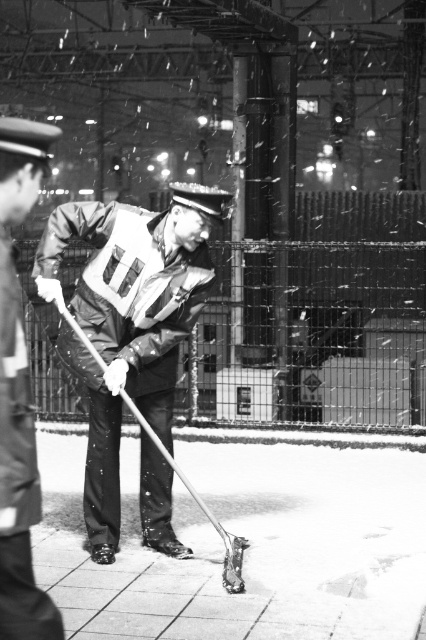
Question: Which point is closer to the camera taking this photo?

Choices:
 (A) (198, 188)
 (B) (147, 589)
 (C) (17, 186)
 (D) (135, 259)

Answer: (C)

Question: Which of the following is the farthest from the observer?

Choices:
 (A) uniformed man at center
 (B) smooth concrete pavement at center
 (C) rubberized black jacket at center
 (D) reflective fabric safety vest at center

Answer: (D)

Question: Where is rubberized black jacket at center located in relation to uniformed man at center in the image?

Choices:
 (A) below
 (B) above

Answer: (A)

Question: Considering the relative positions of uniformed man at center and reflective fabric safety vest at center in the image provided, where is uniformed man at center located with respect to reflective fabric safety vest at center?

Choices:
 (A) below
 (B) above

Answer: (A)

Question: Is rubberized black jacket at center further to camera compared to uniformed man at center?

Choices:
 (A) yes
 (B) no

Answer: (A)

Question: Which point appears closest to the camera in this image?

Choices:
 (A) (0, 504)
 (B) (313, 451)
 (C) (92, 492)

Answer: (A)